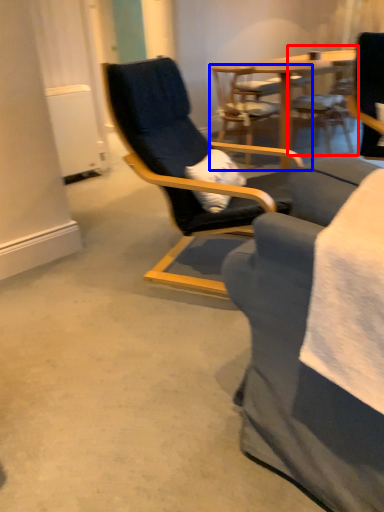
Question: Which of the following is the farthest to the observer, chair (highlighted by a red box) or chair (highlighted by a blue box)?

Choices:
 (A) chair
 (B) chair

Answer: (A)